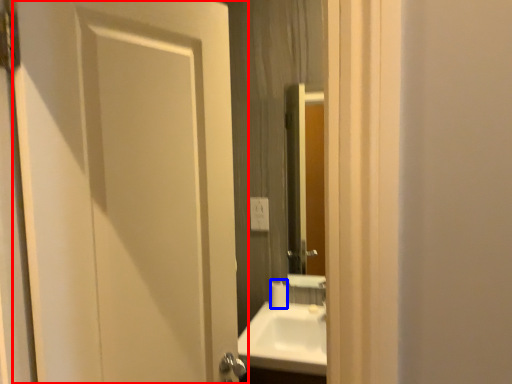
Question: Among these objects, which one is nearest to the camera, door (highlighted by a red box) or toilet paper (highlighted by a blue box)?

Choices:
 (A) door
 (B) toilet paper

Answer: (A)